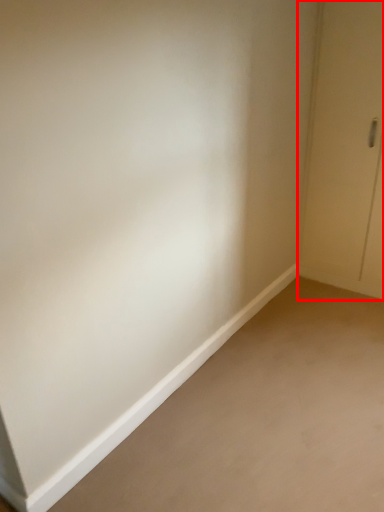
Question: Where is door (annotated by the red box) located in relation to plain in the image?

Choices:
 (A) right
 (B) left

Answer: (A)